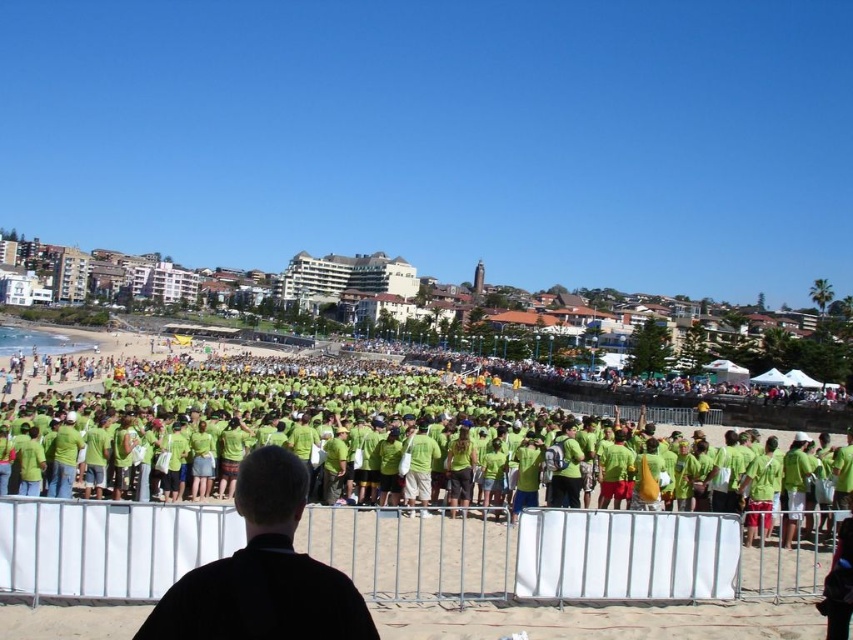
Question: Is green fabric crowd at center below black matte jacket at center?

Choices:
 (A) yes
 (B) no

Answer: (B)

Question: Is green fabric crowd at center closer to camera compared to black matte jacket at center?

Choices:
 (A) yes
 (B) no

Answer: (B)

Question: Can you confirm if green fabric crowd at center is wider than black matte jacket at center?

Choices:
 (A) yes
 (B) no

Answer: (A)